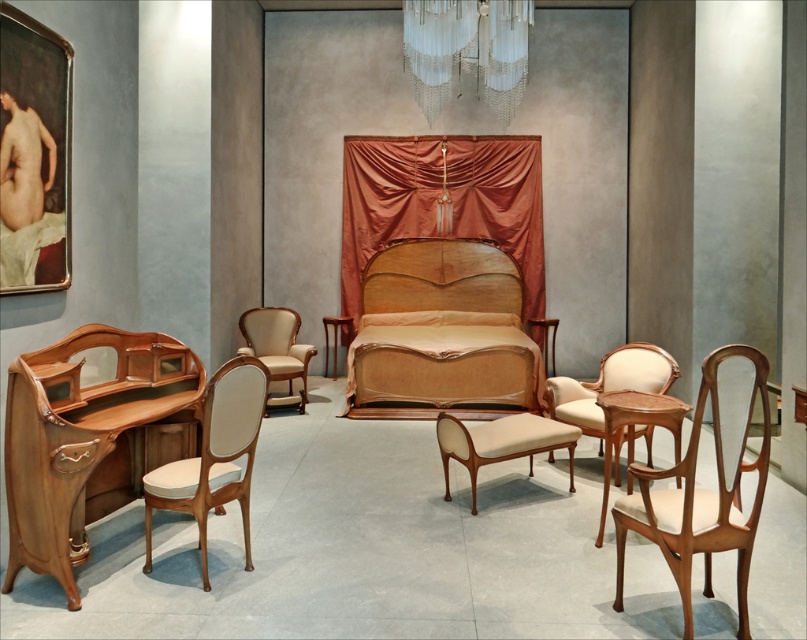
Question: Does matte wood armchair at right appear over clear glass chandelier at upper center?

Choices:
 (A) no
 (B) yes

Answer: (A)

Question: Which point appears farthest from the camera in this image?

Choices:
 (A) (375, 387)
 (B) (270, 358)
 (C) (406, 184)

Answer: (C)

Question: Can you confirm if wooden bed at center is positioned to the right of light beige fabric chair at lower left?

Choices:
 (A) no
 (B) yes

Answer: (B)

Question: Which object is the farthest from the silky orange curtain at center?

Choices:
 (A) wooden headboard at center
 (B) matte cream armchair at center

Answer: (B)

Question: Estimate the real-world distances between objects in this image. Which object is closer to the light beige fabric chair at lower left?

Choices:
 (A) light beige fabric armchair at center
 (B) light brown wood desk at lower left

Answer: (B)

Question: Is wooden headboard at center positioned at the back of light brown wood side table at center right?

Choices:
 (A) yes
 (B) no

Answer: (A)